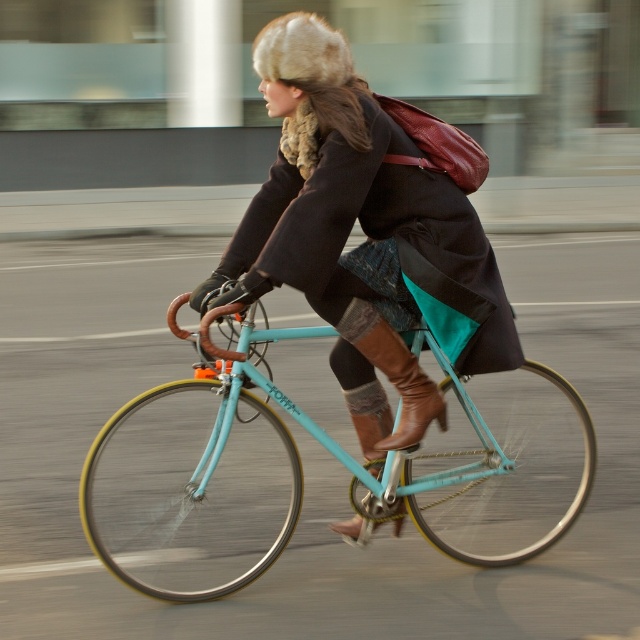
You are a delivery person trying to navigate through a narrow alley that is only 1.5 meters wide. You are riding the teal matte bicycle at center while wearing the matte black coat at center. Can you pass through the alley without removing any items?

The teal matte bicycle at center is wider than the matte black coat at center. Since the alley is 1.5 meters wide, the teal matte bicycle at center must be narrower than 1.5 meters to fit. However, without knowing the exact width of the bicycle, we cannot confirm if it will fit. The coat itself does not affect the width required for the bicycle.

You are a delivery person who needs to attach a small package to your teal matte bicycle at center. However, there is a brown leather boot at center in the way. Can you move the boot out of the way to access the bicycle?

The teal matte bicycle at center is bigger than the brown leather boot at center, so you can move the boot out of the way to access the bicycle.

You are a delivery driver who needs to place a package on the teal matte bicycle at center. The delivery zone requires the package to be placed exactly at the point marked as point (336, 458). Can you confirm if the teal matte bicycle at center is positioned correctly at that point?

The teal matte bicycle at center is located at point (336, 458), so yes, it is positioned correctly at the required delivery point.